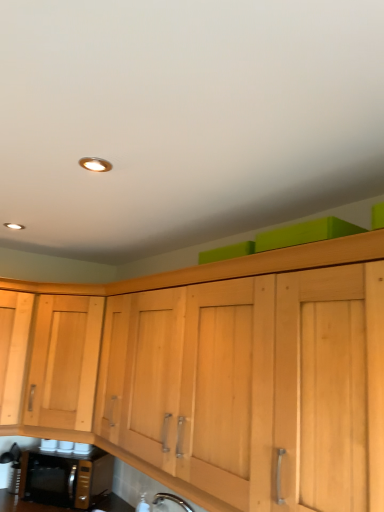
Question: Considering the positions of light wood cabinet at left and black metallic microwave oven at lower left in the image, is light wood cabinet at left bigger or smaller than black metallic microwave oven at lower left?

Choices:
 (A) big
 (B) small

Answer: (A)

Question: From the image's perspective, is light wood cabinet at left located above or below black metallic microwave oven at lower left?

Choices:
 (A) below
 (B) above

Answer: (B)

Question: In the image, is light wood cabinet at left positioned in front of or behind black metallic microwave oven at lower left?

Choices:
 (A) front
 (B) behind

Answer: (A)

Question: In terms of size, does black metallic microwave oven at lower left appear bigger or smaller than light wood cabinet at left?

Choices:
 (A) small
 (B) big

Answer: (A)

Question: From the image's perspective, is black metallic microwave oven at lower left above or below light wood cabinet at left?

Choices:
 (A) above
 (B) below

Answer: (B)

Question: From a real-world perspective, relative to light wood cabinet at left, is black metallic microwave oven at lower left vertically above or below?

Choices:
 (A) below
 (B) above

Answer: (A)

Question: Considering their positions, is black metallic microwave oven at lower left located in front of or behind light wood cabinet at left?

Choices:
 (A) behind
 (B) front

Answer: (A)